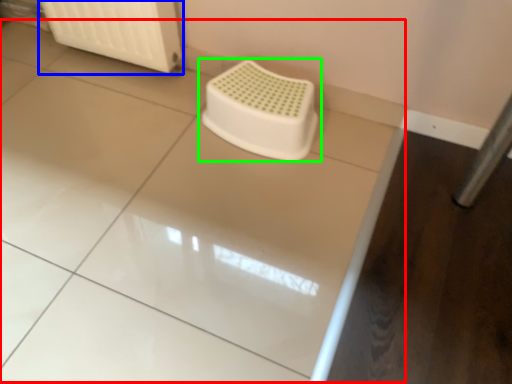
Question: Which object is positioned closest to counter top (highlighted by a red box)? Select from radiator (highlighted by a blue box) and toilet (highlighted by a green box).

Choices:
 (A) radiator
 (B) toilet

Answer: (B)